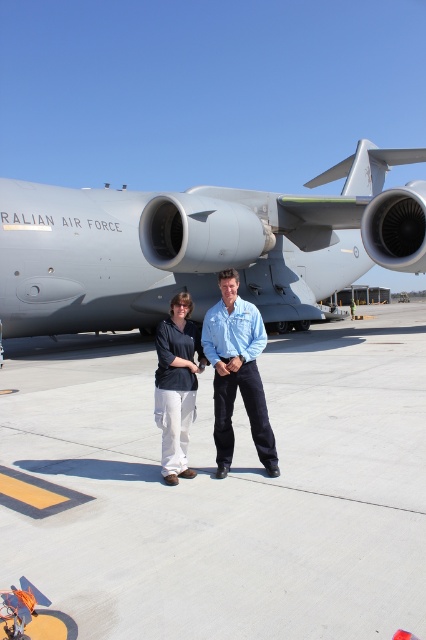
Question: Does smooth concrete tarmac at center appear on the left side of matte black shirt at center?

Choices:
 (A) no
 (B) yes

Answer: (B)

Question: Which object is positioned closest to the light blue shirt at center?

Choices:
 (A) matte black shirt at center
 (B) smooth concrete tarmac at center

Answer: (A)

Question: From the image, what is the correct spatial relationship of smooth concrete tarmac at center in relation to light blue shirt at center?

Choices:
 (A) above
 (B) below

Answer: (B)

Question: Which of the following is the closest to the observer?

Choices:
 (A) matte black shirt at center
 (B) smooth concrete tarmac at center
 (C) gray matte airplane at center

Answer: (B)

Question: From the image, what is the correct spatial relationship of smooth concrete tarmac at center in relation to matte black shirt at center?

Choices:
 (A) above
 (B) below

Answer: (B)

Question: Based on their relative distances, which object is nearer to the matte black shirt at center?

Choices:
 (A) gray matte airplane at center
 (B) smooth concrete tarmac at center
 (C) light blue shirt at center

Answer: (C)